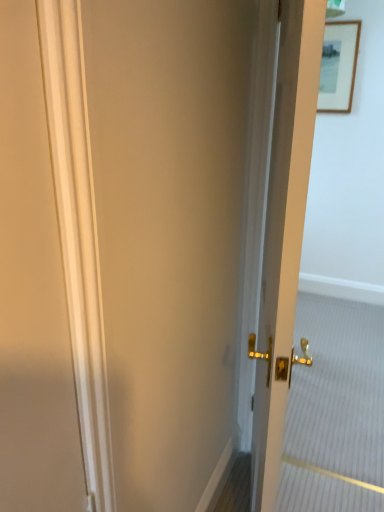
The height and width of the screenshot is (512, 384). What do you see at coordinates (338, 66) in the screenshot?
I see `wooden framed picture at upper right` at bounding box center [338, 66].

In order to click on wooden framed picture at upper right in this screenshot , I will do `click(338, 66)`.

The height and width of the screenshot is (512, 384). What do you see at coordinates (284, 234) in the screenshot?
I see `matte gold door at center` at bounding box center [284, 234].

Where is `matte gold door at center`? The image size is (384, 512). matte gold door at center is located at coordinates (284, 234).

In order to click on wooden framed picture at upper right in this screenshot , I will do `click(338, 66)`.

Which is more to the left, matte gold door at center or wooden framed picture at upper right?

matte gold door at center is more to the left.

Considering their positions, is matte gold door at center located in front of or behind wooden framed picture at upper right?

matte gold door at center is in front of wooden framed picture at upper right.

Is point (287, 61) positioned behind point (358, 35)?

No, it is not.

From the image's perspective, is matte gold door at center above wooden framed picture at upper right?

No, from the image's perspective, matte gold door at center is not on top of wooden framed picture at upper right.

From a real-world perspective, does matte gold door at center stand above wooden framed picture at upper right?

Actually, matte gold door at center is physically below wooden framed picture at upper right in the real world.

Does matte gold door at center have a greater width compared to wooden framed picture at upper right?

Correct, the width of matte gold door at center exceeds that of wooden framed picture at upper right.

In the scene shown: Which of these two, matte gold door at center or wooden framed picture at upper right, stands shorter?

With less height is wooden framed picture at upper right.

Considering the relative sizes of matte gold door at center and wooden framed picture at upper right in the image provided, is matte gold door at center smaller than wooden framed picture at upper right?

Incorrect, matte gold door at center is not smaller in size than wooden framed picture at upper right.

Is wooden framed picture at upper right surrounded by matte gold door at center?

No, wooden framed picture at upper right is not surrounded by matte gold door at center.

Are matte gold door at center and wooden framed picture at upper right far apart?

Yes, matte gold door at center and wooden framed picture at upper right are quite far apart.

Is matte gold door at center facing towards wooden framed picture at upper right?

No, matte gold door at center is not facing towards wooden framed picture at upper right.

How many degrees apart are the facing directions of matte gold door at center and wooden framed picture at upper right?

They differ by 106 degrees in their facing directions.

Where is `picture frame behind the matte gold door at center`? picture frame behind the matte gold door at center is located at coordinates (338, 66).

Can you confirm if wooden framed picture at upper right is positioned to the left of matte gold door at center?

In fact, wooden framed picture at upper right is to the right of matte gold door at center.

In the image, is wooden framed picture at upper right positioned in front of or behind matte gold door at center?

Visually, wooden framed picture at upper right is located behind matte gold door at center.

Does point (345, 105) lie behind point (293, 194)?

Yes, point (345, 105) is behind point (293, 194).

From the image's perspective, is wooden framed picture at upper right located above matte gold door at center?

Yes, from the image's perspective, wooden framed picture at upper right is over matte gold door at center.

Looking at this image, from a real-world perspective, is wooden framed picture at upper right physically below matte gold door at center?

No, from a real-world perspective, wooden framed picture at upper right is not beneath matte gold door at center.

Between wooden framed picture at upper right and matte gold door at center, which one has smaller width?

wooden framed picture at upper right is thinner.

Between wooden framed picture at upper right and matte gold door at center, which one has less height?

wooden framed picture at upper right is shorter.

Consider the image. Considering the sizes of objects wooden framed picture at upper right and matte gold door at center in the image provided, who is bigger, wooden framed picture at upper right or matte gold door at center?

matte gold door at center.

Is wooden framed picture at upper right not within matte gold door at center?

wooden framed picture at upper right lies outside matte gold door at center's area.

Is wooden framed picture at upper right not close to matte gold door at center?

A: wooden framed picture at upper right is positioned a significant distance from matte gold door at center.

Is wooden framed picture at upper right oriented towards matte gold door at center?

Yes, wooden framed picture at upper right is turned towards matte gold door at center.

How many degrees apart are the facing directions of wooden framed picture at upper right and matte gold door at center?

There is a 106-degree angle between the facing directions of wooden framed picture at upper right and matte gold door at center.

What are the coordinates of `door below the wooden framed picture at upper right (from a real-world perspective)` in the screenshot? It's located at (284, 234).

Where is `door lying in front of the wooden framed picture at upper right`? The width and height of the screenshot is (384, 512). door lying in front of the wooden framed picture at upper right is located at coordinates coord(284,234).

At what (x,y) coordinates should I click in order to perform the action: click on door located underneath the wooden framed picture at upper right (from a real-world perspective). Please return your answer as a coordinate pair (x, y). The height and width of the screenshot is (512, 384). Looking at the image, I should click on (284, 234).